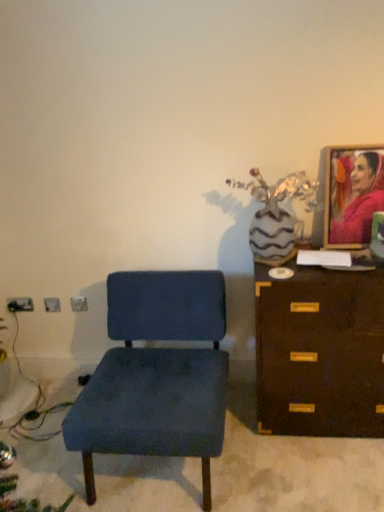
Question: Does velvet blue chair at center have a greater height compared to matte pink fabric portrait at upper right?

Choices:
 (A) no
 (B) yes

Answer: (B)

Question: Is matte pink fabric portrait at upper right completely or partially inside velvet blue chair at center?

Choices:
 (A) yes
 (B) no

Answer: (B)

Question: Considering the relative sizes of velvet blue chair at center and matte pink fabric portrait at upper right in the image provided, is velvet blue chair at center thinner than matte pink fabric portrait at upper right?

Choices:
 (A) no
 (B) yes

Answer: (A)

Question: Is velvet blue chair at center bigger than matte pink fabric portrait at upper right?

Choices:
 (A) yes
 (B) no

Answer: (A)

Question: From the image's perspective, is velvet blue chair at center located above matte pink fabric portrait at upper right?

Choices:
 (A) no
 (B) yes

Answer: (A)

Question: Is velvet blue chair at center not near matte pink fabric portrait at upper right?

Choices:
 (A) no
 (B) yes

Answer: (A)

Question: Is velvet blue chair at center oriented away from brown wooden chest of drawers at right?

Choices:
 (A) no
 (B) yes

Answer: (A)

Question: Is velvet blue chair at center positioned before brown wooden chest of drawers at right?

Choices:
 (A) yes
 (B) no

Answer: (A)

Question: From a real-world perspective, does velvet blue chair at center stand above brown wooden chest of drawers at right?

Choices:
 (A) no
 (B) yes

Answer: (A)

Question: Is velvet blue chair at center positioned beyond the bounds of brown wooden chest of drawers at right?

Choices:
 (A) no
 (B) yes

Answer: (B)

Question: From the image's perspective, is velvet blue chair at center beneath brown wooden chest of drawers at right?

Choices:
 (A) yes
 (B) no

Answer: (A)

Question: Would you say brown wooden chest of drawers at right is part of velvet blue chair at center's contents?

Choices:
 (A) no
 (B) yes

Answer: (A)

Question: Is matte pink fabric portrait at upper right in contact with velvet blue chair at center?

Choices:
 (A) no
 (B) yes

Answer: (A)